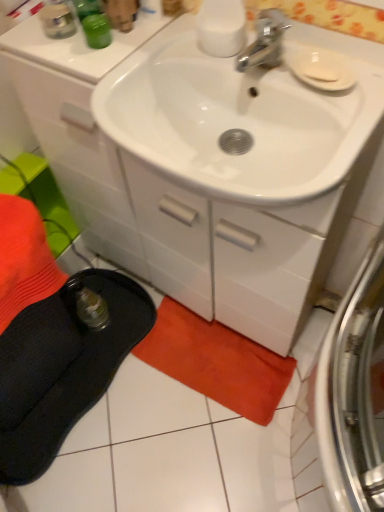
Where is `free location above orange cotton beach towel at lower center (from a real-world perspective)`? free location above orange cotton beach towel at lower center (from a real-world perspective) is located at coordinates (216, 352).